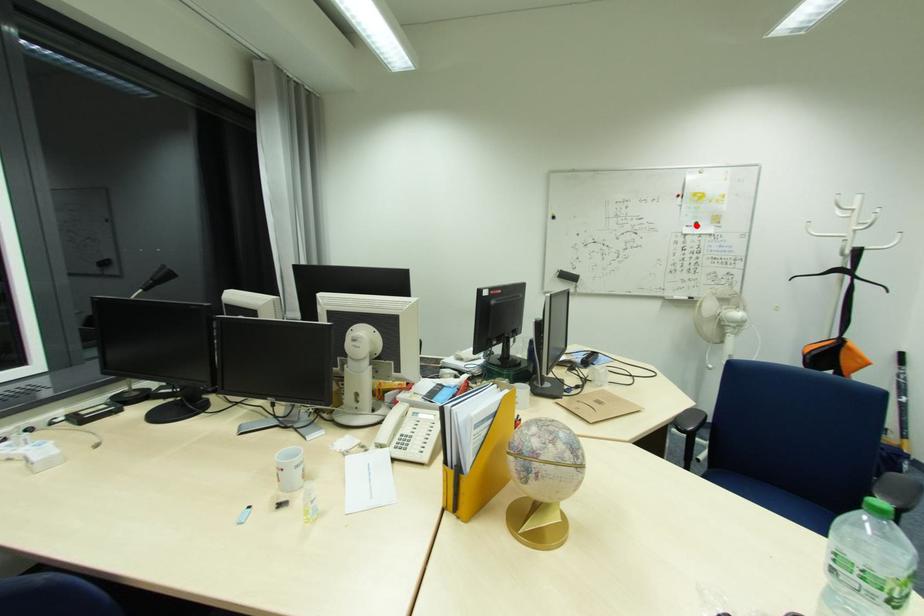
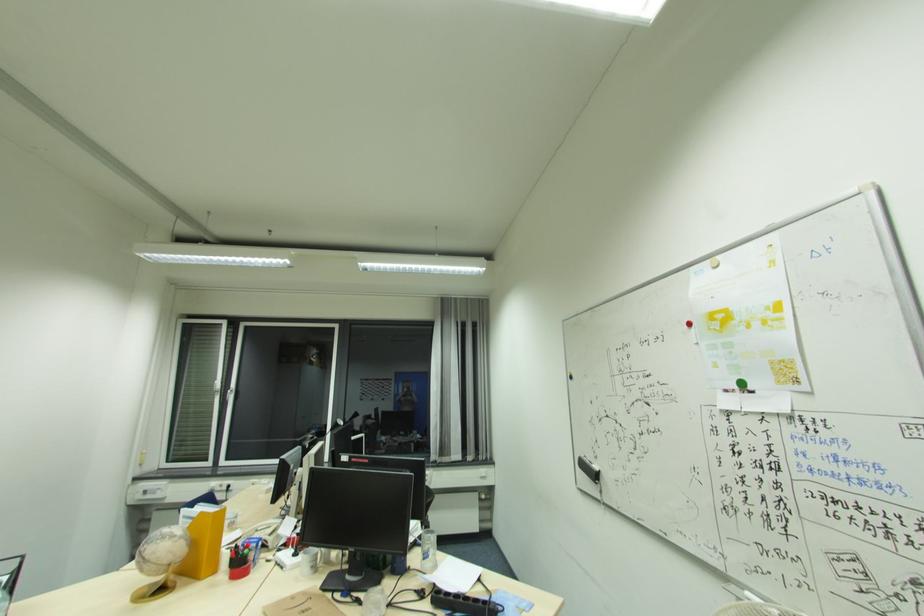
The point at the highlighted location is marked in the first image. Where is the corresponding point in the second image?

(739, 387)